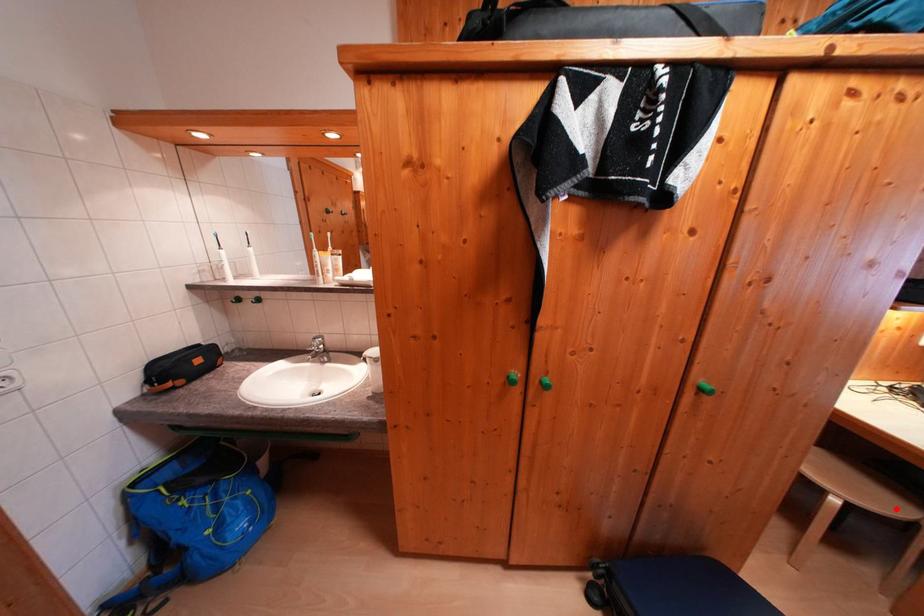
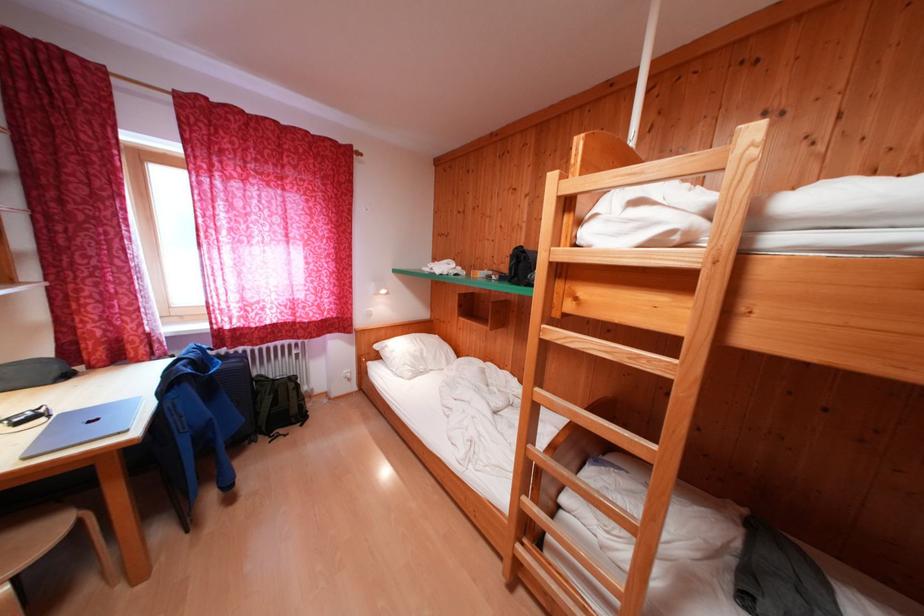
Question: I am providing you with two images of the same scene from different viewpoints. A red point is shown in image1. For the corresponding object point in image2, is it positioned nearer or farther from the camera?

Choices:
 (A) Nearer
 (B) Farther

Answer: (A)